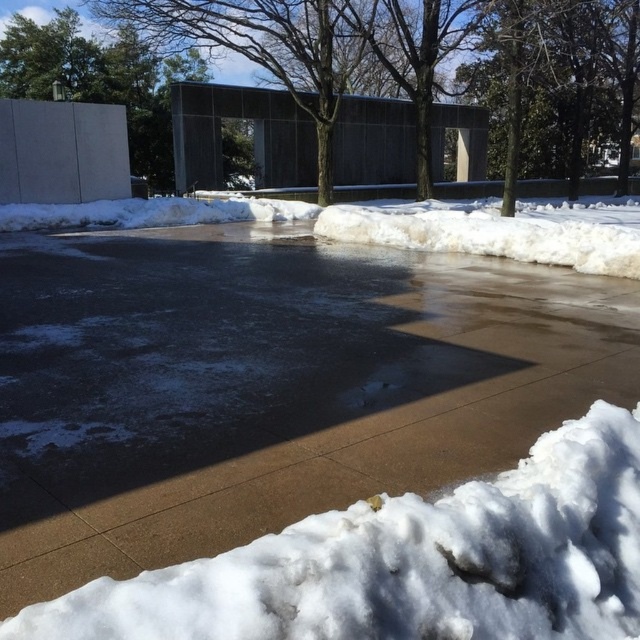
You are standing at the point with coordinates 0.5, 0.5 in the image. You want to walk to the brown concrete pavement at center. In which direction should you move?

The brown concrete pavement at center is located at point [320,444]. Since you are at [320,320], you should move to the right to reach it.

You are a delivery robot with a 6 feet long package. You need to move the package from the brown concrete pavement at center to the white fluffy snow at center. Can you move it without tilting the package?

The distance between the brown concrete pavement at center and the white fluffy snow at center is 5.87 feet. Since the package is 6 feet long, it is slightly longer than the available space. Therefore, you cannot move the package without tilting it to fit within the 5.87 feet distance.

You are a delivery person trying to place a box on the ground in the winter scene. The box requires a flat surface that is higher than the surrounding snow. Can you place the box on the brown concrete pavement at center without it sliding onto the white fluffy snow at center?

The brown concrete pavement at center has a greater height compared to white fluffy snow at center, so placing the box on the brown concrete pavement at center should keep it stable and prevent it from sliding onto the lower white fluffy snow at center.